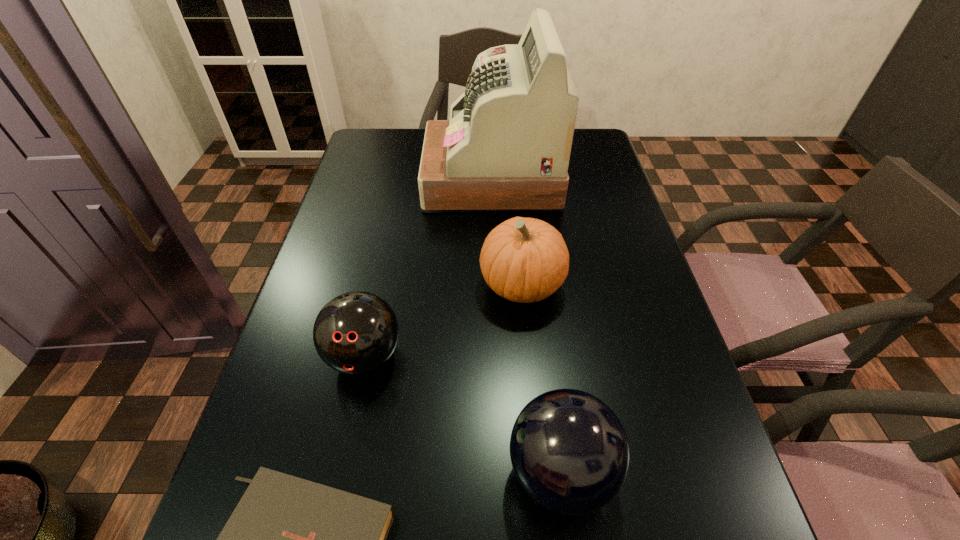
Identify the location of free space located 0.260m on the stem of the pumpkin. This screenshot has height=540, width=960. (366, 285).

This screenshot has width=960, height=540. I want to click on vacant space situated 0.070m on the stem of the pumpkin, so click(448, 285).

The height and width of the screenshot is (540, 960). Identify the location of free space located on the side of the nearer bowling ball with the finger holes. (317, 472).

I want to click on vacant space situated on the side of the nearer bowling ball with the finger holes, so click(293, 472).

Identify the location of free space located on the side of the nearer bowling ball with the finger holes. tap(274, 472).

Image resolution: width=960 pixels, height=540 pixels. What are the coordinates of `free location located on the surface of the third farthest object near the finger holes` in the screenshot? It's located at (329, 521).

Where is `object at the far edge`? object at the far edge is located at coordinates (506, 147).

What are the coordinates of `object that is at the left edge` in the screenshot? It's located at (356, 332).

This screenshot has width=960, height=540. In the image, there is a desktop. Find the location of `free space at the left edge`. free space at the left edge is located at coordinates (336, 224).

The image size is (960, 540). In order to click on blank space at the right edge in this screenshot , I will do `click(636, 278)`.